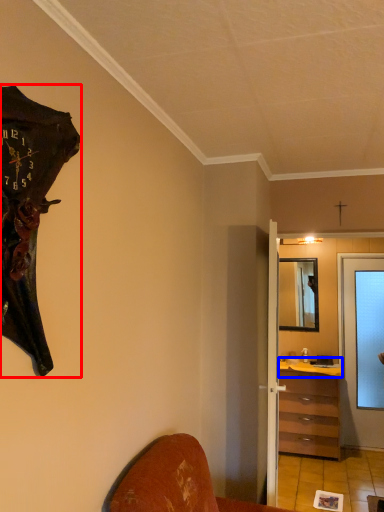
Question: Which of the following is the farthest to the observer, wall clock (highlighted by a red box) or counter top (highlighted by a blue box)?

Choices:
 (A) wall clock
 (B) counter top

Answer: (B)